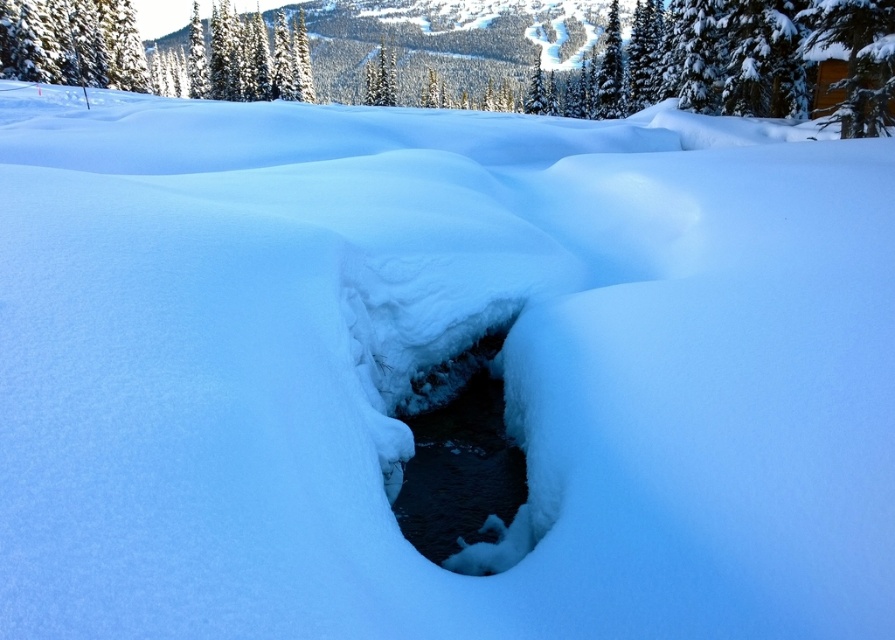
You are an outdoor photographer planning to capture the clear ice hole at center and the green textured tree at upper left in the same frame. Based on their positions, can you determine which object is closer to the camera?

The clear ice hole at center is below the green textured tree at upper left, so the clear ice hole at center is closer to the camera than the green textured tree at upper left.